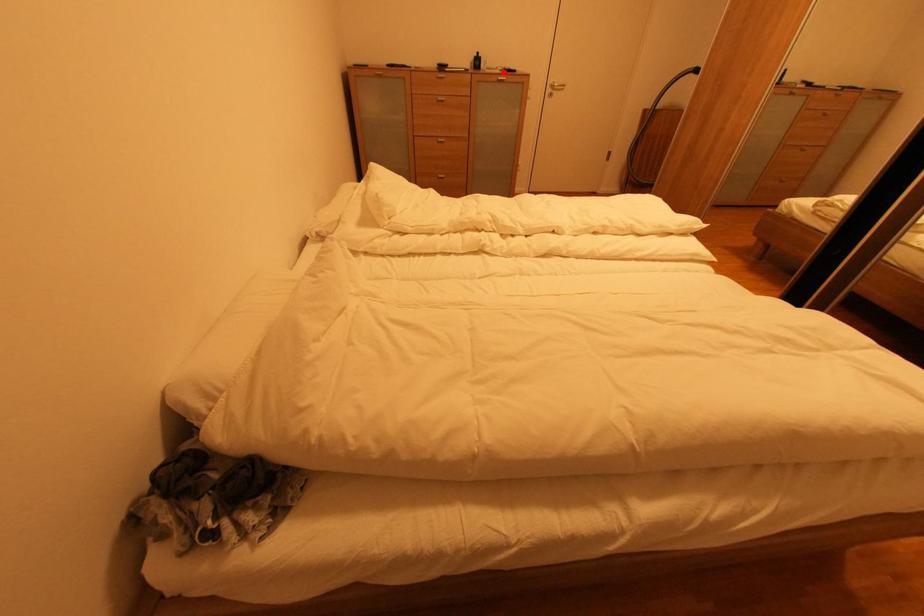
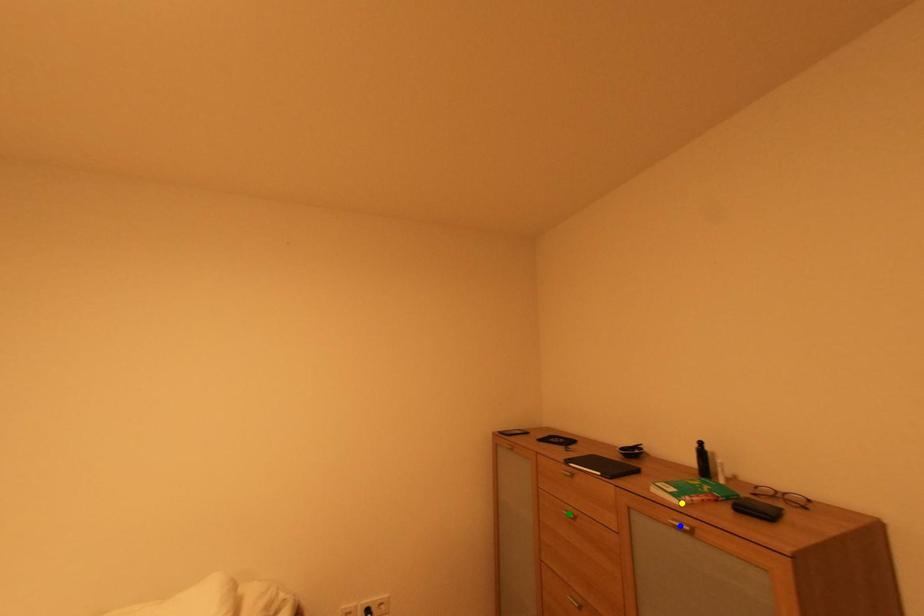
Question: I am providing you with two images of the same scene from different viewpoints. A red point is marked on the first image. You are given multiple points on the second image. Can you choose the point in image 2 that corresponds to the point in image 1?

Choices:
 (A) blue point
 (B) yellow point
 (C) green point

Answer: (B)